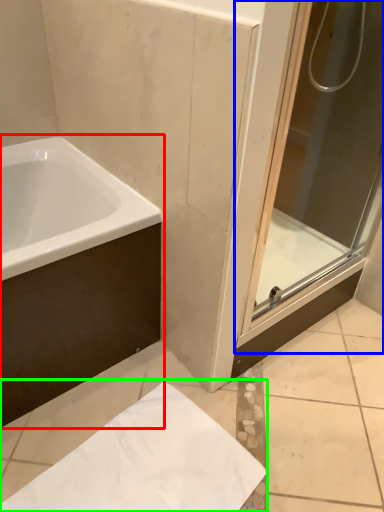
Question: Estimate the real-world distances between objects in this image. Which object is closer to bathtub (highlighted by a red box), screen door (highlighted by a blue box) or paper (highlighted by a green box)?

Choices:
 (A) screen door
 (B) paper

Answer: (B)